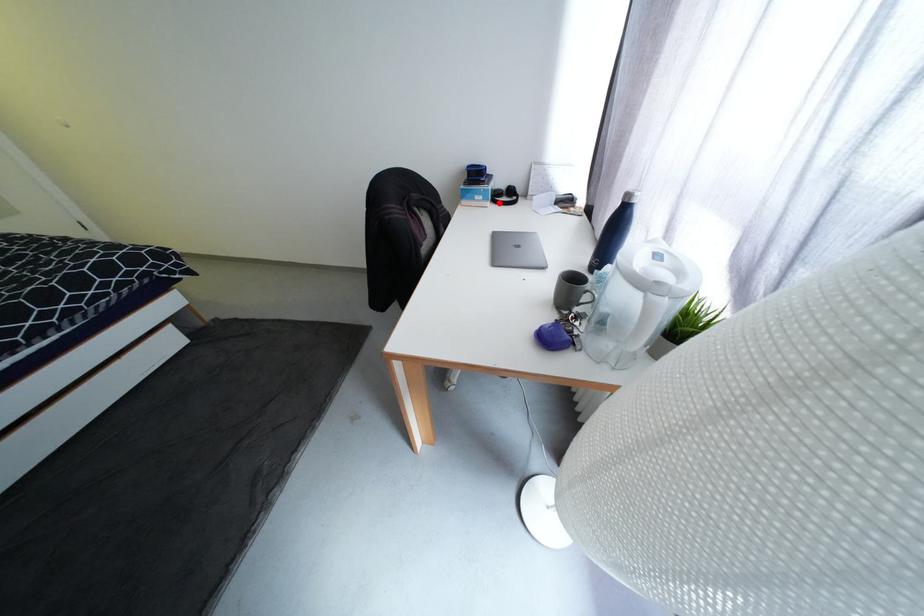
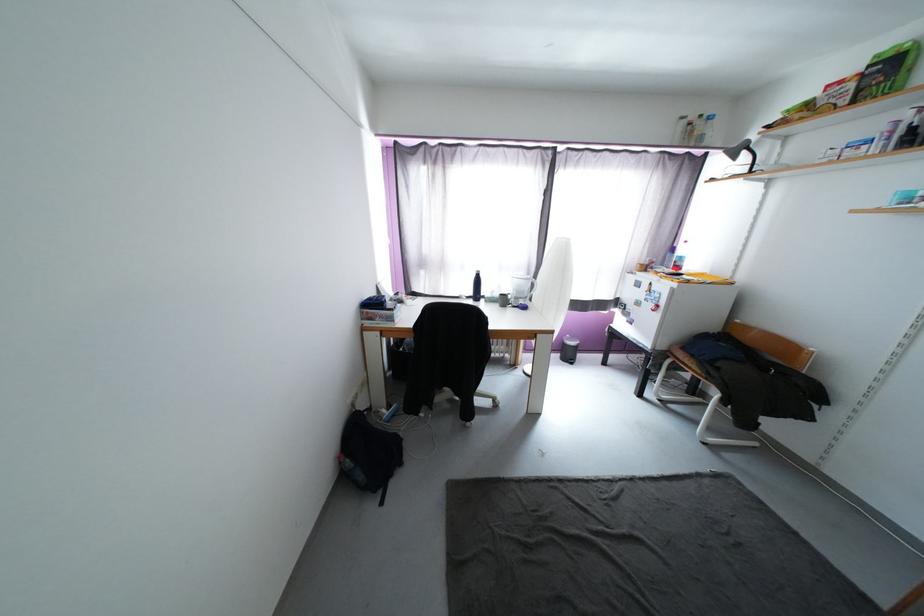
Question: I am providing you with two images of the same scene from different viewpoints. A red point is marked on the first image. At the location where the point appears in image 1, is it still visible in image 2?

Choices:
 (A) Yes
 (B) No

Answer: (B)